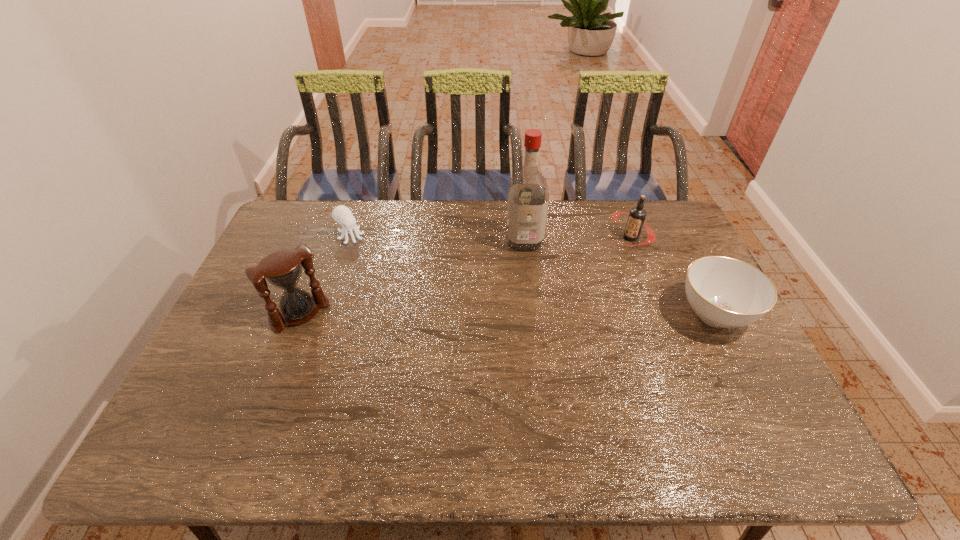
In order to click on object situated at the left edge in this screenshot , I will do `click(283, 269)`.

You are a GUI agent. You are given a task and a screenshot of the screen. Output one action in this format:
    pyautogui.click(x=<x>, y=<y>)
    Task: Click on the chinaware at the right edge
    
    Given the screenshot: What is the action you would take?
    pyautogui.click(x=724, y=292)

At what (x,y) coordinates should I click in order to perform the action: click on root beer that is at the right edge. Please return your answer as a coordinate pair (x, y). The height and width of the screenshot is (540, 960). Looking at the image, I should click on (637, 215).

Image resolution: width=960 pixels, height=540 pixels. I want to click on object that is positioned at the far right corner, so click(x=637, y=215).

You are a GUI agent. You are given a task and a screenshot of the screen. Output one action in this format:
    pyautogui.click(x=<x>, y=<y>)
    Task: Click on the vacant space at the far edge of the desktop
    
    Given the screenshot: What is the action you would take?
    pyautogui.click(x=386, y=205)

In the image, there is a desktop. Identify the location of vacant space at the near edge. (416, 389).

Locate an element on the screen. vacant position at the left edge of the desktop is located at coordinates (212, 368).

This screenshot has height=540, width=960. I want to click on vacant region at the far right corner of the desktop, so click(x=665, y=231).

Where is `vacant space in between the liquor and the chinaware`? vacant space in between the liquor and the chinaware is located at coordinates (619, 278).

Identify the location of free space between the third object from right to left and the third shortest object. (577, 239).